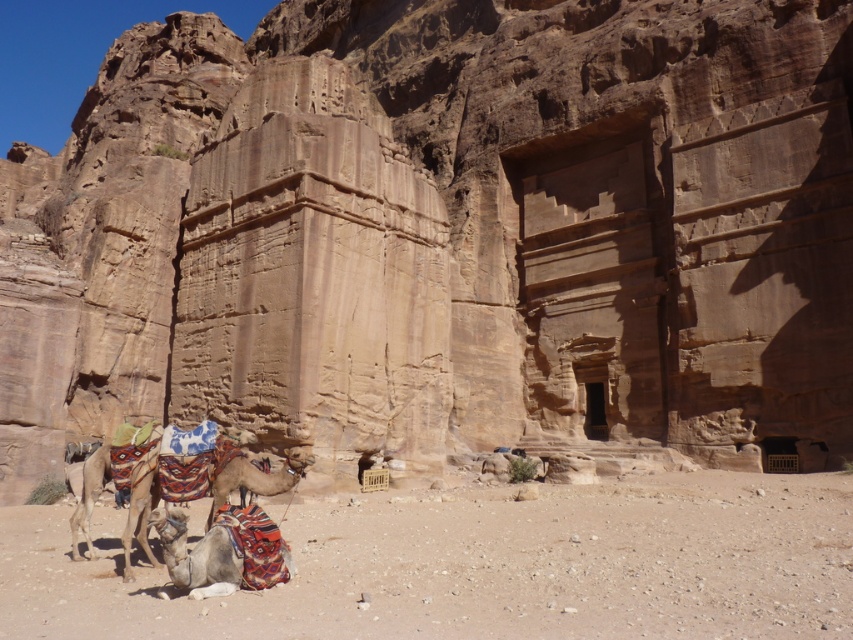
Between desert sand at lower left and multicolored fabric camel at lower center, which one appears on the left side from the viewer's perspective?

multicolored fabric camel at lower center is more to the left.

Between desert sand at lower left and multicolored fabric camel at lower center, which one has more height?

With more height is desert sand at lower left.

Which is in front, point (589, 513) or point (287, 547)?

Point (287, 547) is more forward.

The height and width of the screenshot is (640, 853). I want to click on desert sand at lower left, so click(x=482, y=564).

Does multicolored fabric camel at lower center appear on the right side of brown textured camel at center?

Yes, multicolored fabric camel at lower center is to the right of brown textured camel at center.

Can you confirm if multicolored fabric camel at lower center is positioned above brown textured camel at center?

Correct, multicolored fabric camel at lower center is located above brown textured camel at center.

Is point (165, 538) less distant than point (297, 456)?

Yes.

The width and height of the screenshot is (853, 640). Find the location of `multicolored fabric camel at lower center`. multicolored fabric camel at lower center is located at coordinates (223, 552).

Which is more to the left, multicolored fabric camel at lower center or multicolored fabric camel at lower left?

multicolored fabric camel at lower left is more to the left.

Which of these two, multicolored fabric camel at lower center or multicolored fabric camel at lower left, stands shorter?

multicolored fabric camel at lower center

Identify the location of multicolored fabric camel at lower center. (223, 552).

I want to click on multicolored fabric camel at lower center, so click(x=223, y=552).